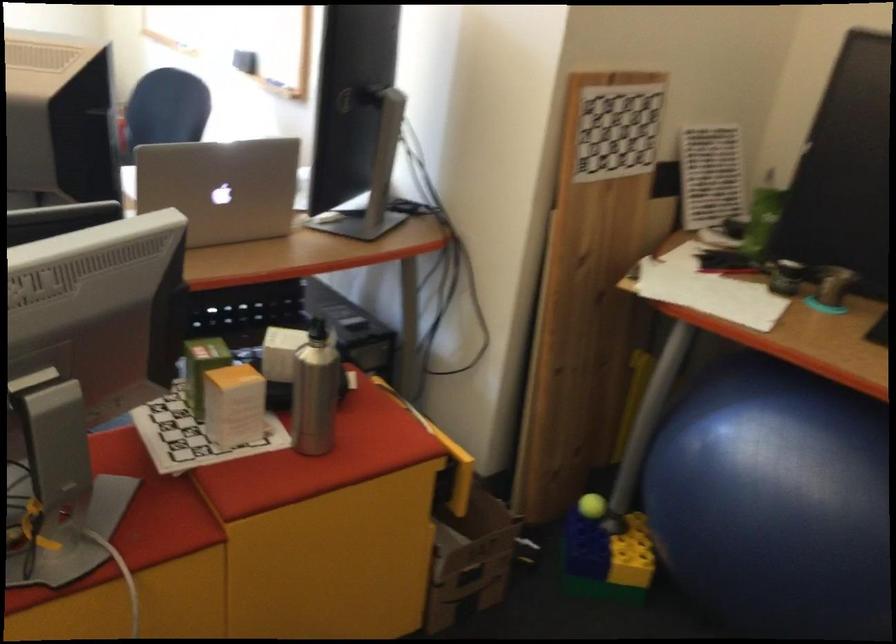
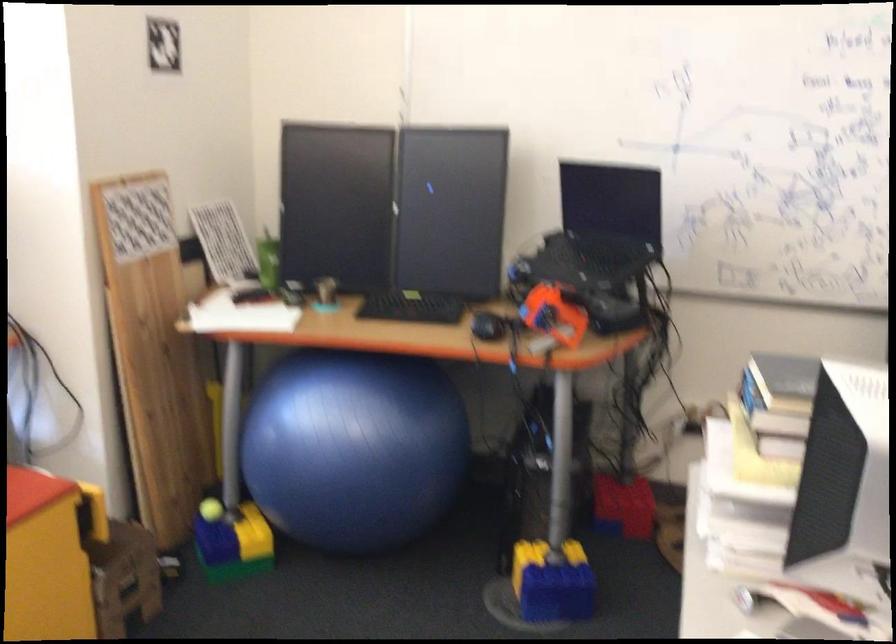
Find the pixel in the second image that matches pixel 755 230 in the first image.

(268, 261)